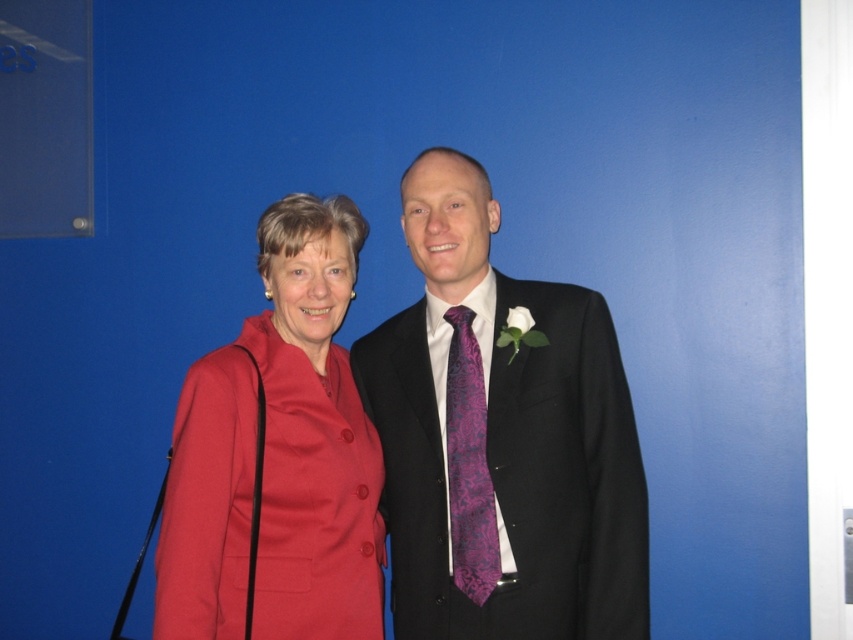
Who is shorter, matte black suit at center or purple textured tie at center?

Standing shorter between the two is purple textured tie at center.

In the scene shown: Is matte black suit at center positioned at the back of purple textured tie at center?

That is False.

Find the location of a particular element. The image size is (853, 640). matte black suit at center is located at coordinates (502, 440).

Is the position of matte red coat at center more distant than that of purple textured tie at center?

No, it is in front of purple textured tie at center.

Which is in front, point (215, 417) or point (491, 580)?

Point (215, 417) is in front.

Identify the location of matte red coat at center. (312, 433).

I want to click on matte red coat at center, so click(312, 433).

Does matte black suit at center have a lesser width compared to matte red coat at center?

Incorrect, matte black suit at center's width is not less than matte red coat at center's.

Does matte black suit at center lie behind matte red coat at center?

Yes, matte black suit at center is further from the viewer.

Between point (514, 406) and point (207, 436), which one is positioned in front?

Point (207, 436) is more forward.

I want to click on matte black suit at center, so click(502, 440).